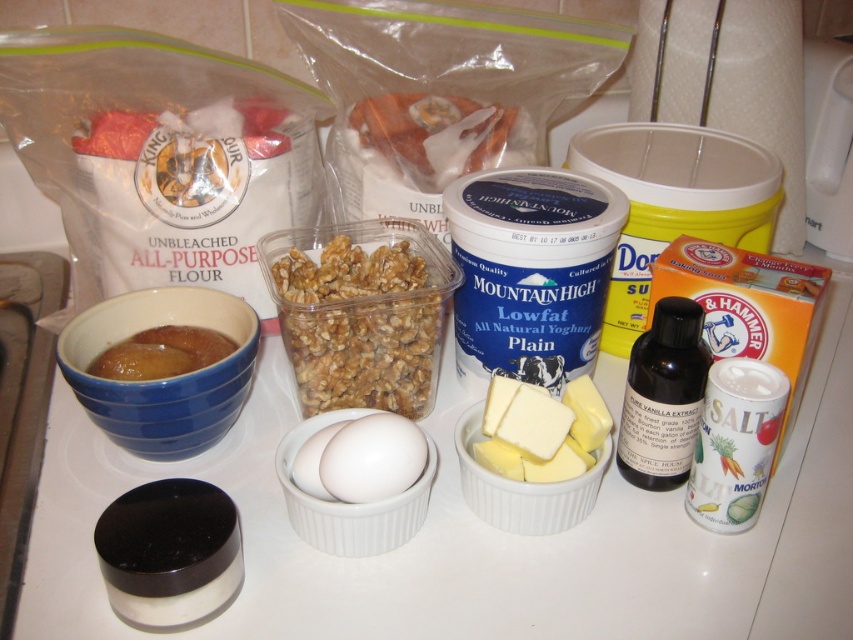
Is blue matte container at center to the right of clear plastic container of walnuts at center from the viewer's perspective?

Correct, you'll find blue matte container at center to the right of clear plastic container of walnuts at center.

Can you confirm if blue matte container at center is positioned to the left of clear plastic container of walnuts at center?

Incorrect, blue matte container at center is not on the left side of clear plastic container of walnuts at center.

The image size is (853, 640). In order to click on blue matte container at center in this screenshot , I will do `click(531, 273)`.

Identify the location of blue matte container at center. tap(531, 273).

Identify the location of clear plastic container of walnuts at center. (361, 312).

Which is more to the left, clear plastic container of walnuts at center or brown glossy jam at left?

Positioned to the left is brown glossy jam at left.

Which is behind, point (300, 342) or point (132, 337)?

Positioned behind is point (132, 337).

At what (x,y) coordinates should I click in order to perform the action: click on clear plastic container of walnuts at center. Please return your answer as a coordinate pair (x, y). This screenshot has width=853, height=640. Looking at the image, I should click on (361, 312).

Based on the photo, does blue matte container at center have a larger size compared to brown glossy jam at left?

Yes, blue matte container at center is bigger than brown glossy jam at left.

Does point (549, 250) lie behind point (91, 371)?

No, it is in front of (91, 371).

Between point (613, 204) and point (206, 346), which one is positioned in front?

Point (613, 204)

Locate an element on the screen. blue matte container at center is located at coordinates (531, 273).